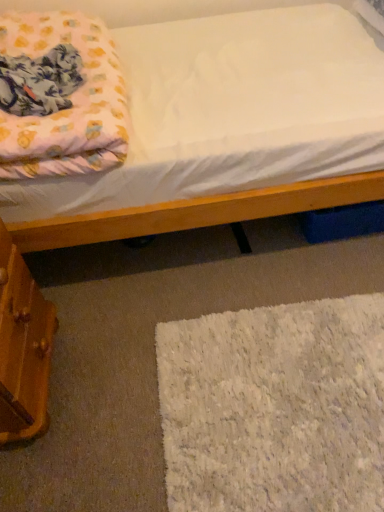
Locate an element on the screen. vacant space underneath white fluffy rug at lower right (from a real-world perspective) is located at coordinates 287,399.